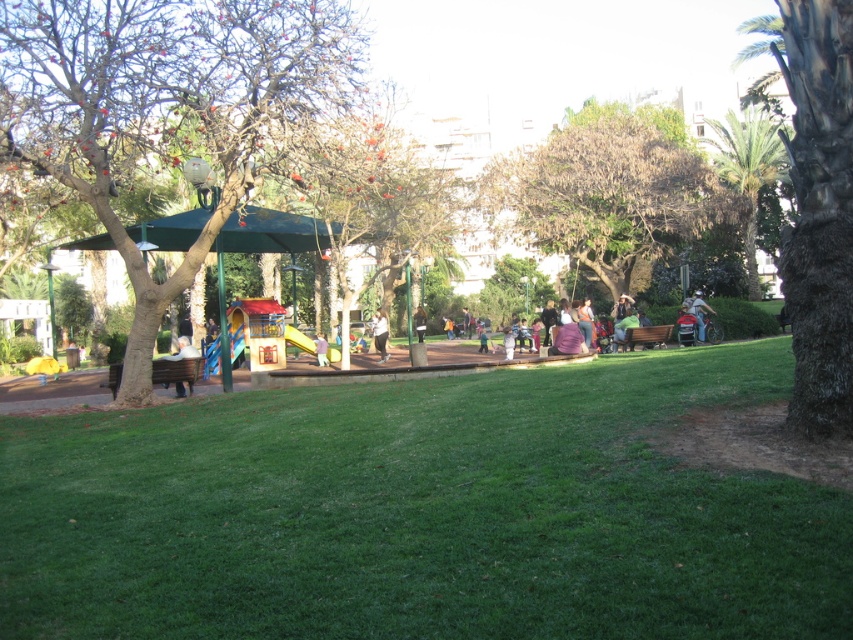
You are a GUI agent. You are given a task and a screenshot of the screen. Output one action in this format:
    pyautogui.click(x=<x>, y=<y>)
    Task: Click on the brown wooden bench at center
    The width and height of the screenshot is (853, 640).
    Given the screenshot: What is the action you would take?
    point(643,337)

In the scene shown: Which of these two, brown wooden bench at center or white matte shirt at center, stands shorter?

brown wooden bench at center

Image resolution: width=853 pixels, height=640 pixels. What do you see at coordinates (643, 337) in the screenshot? I see `brown wooden bench at center` at bounding box center [643, 337].

You are a GUI agent. You are given a task and a screenshot of the screen. Output one action in this format:
    pyautogui.click(x=<x>, y=<y>)
    Task: Click on the brown wooden bench at center
    This screenshot has width=853, height=640.
    Given the screenshot: What is the action you would take?
    pyautogui.click(x=643, y=337)

Is point (821, 214) closer to camera compared to point (424, 332)?

Yes.

Is green rough bark tree at right taller than brown leather jacket at center?

Yes, green rough bark tree at right is taller than brown leather jacket at center.

Between point (817, 346) and point (422, 321), which one is positioned behind?

Point (422, 321)

Where is `green rough bark tree at right`? This screenshot has height=640, width=853. green rough bark tree at right is located at coordinates (819, 212).

Can you confirm if green grassy area at center is positioned to the right of white matte shirt at center?

Correct, you'll find green grassy area at center to the right of white matte shirt at center.

From the picture: Is green grassy area at center positioned behind white matte shirt at center?

No, green grassy area at center is in front of white matte shirt at center.

What do you see at coordinates (421, 513) in the screenshot? The image size is (853, 640). I see `green grassy area at center` at bounding box center [421, 513].

Locate an element on the screen. The height and width of the screenshot is (640, 853). green grassy area at center is located at coordinates (421, 513).